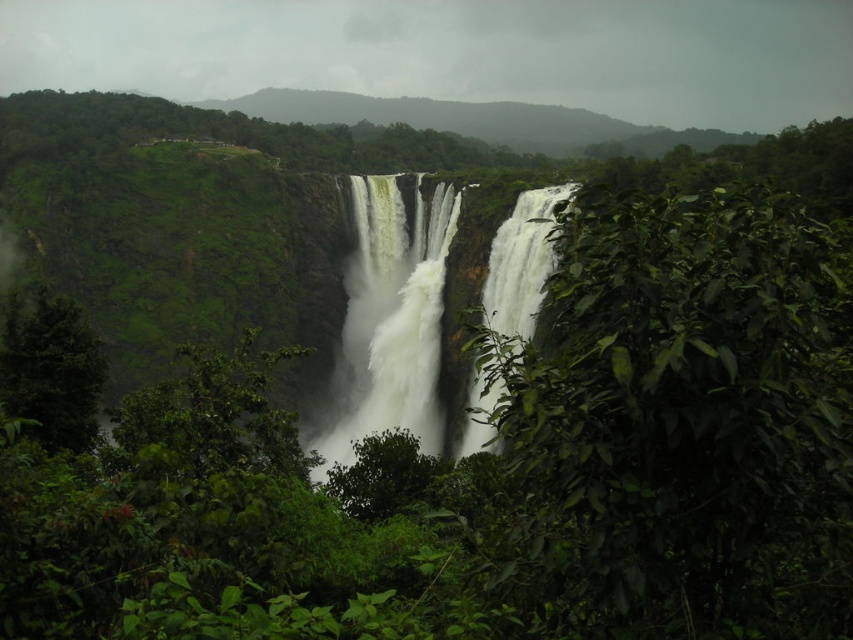
From the picture: You are standing at the base of the waterfall and notice a green leafy bush at right and a green leafy tree at left. Which one is closer to your right side?

The green leafy bush at right is closer to your right side because it is positioned on the right side of the green leafy tree at left.

You are a hiker who wants to cross the river below the waterfall. You have a 30 meter long rope. You see the green leafy bush at right and the green leafy tree at left. Can you use the rope to safely cross the river between them?

The green leafy bush at right and green leafy tree at left are 36.20 meters apart from each other. The rope is only 30 meters long, so it is not long enough to safely cross the river between them.